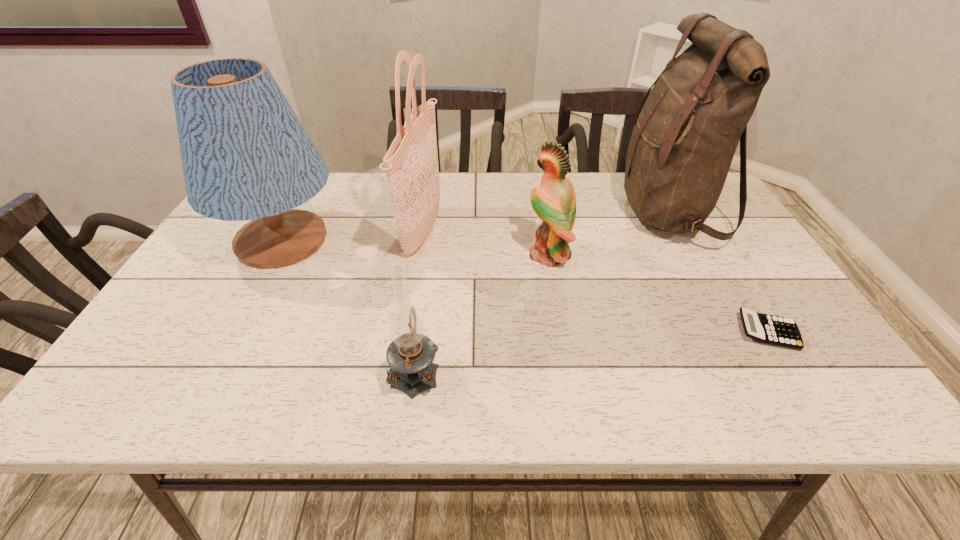
The image size is (960, 540). Identify the location of vacant space that satisfies the following two spatial constraints: 1. on the front side of the oil lamp; 2. on the right side of the shopping bag. (399, 370).